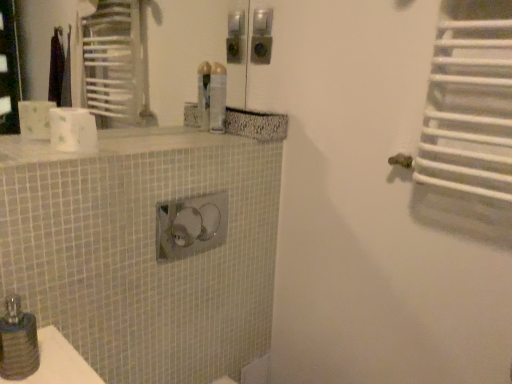
Question: Is point (10, 319) closer or farther from the camera than point (92, 142)?

Choices:
 (A) farther
 (B) closer

Answer: (B)

Question: Would you say matte black soap dispenser at lower left is to the left or to the right of white matte toilet paper at upper left in the picture?

Choices:
 (A) right
 (B) left

Answer: (B)

Question: Estimate the real-world distances between objects in this image. Which object is closer to the white matte toilet paper at upper left?

Choices:
 (A) white mosaic tile counter top at upper center
 (B) translucent plastic spray can at upper center
 (C) matte black soap dispenser at lower left

Answer: (A)

Question: Estimate the real-world distances between objects in this image. Which object is farther from the white mosaic tile counter top at upper center?

Choices:
 (A) translucent plastic spray can at upper center
 (B) matte black soap dispenser at lower left
 (C) white matte toilet paper at upper left

Answer: (B)